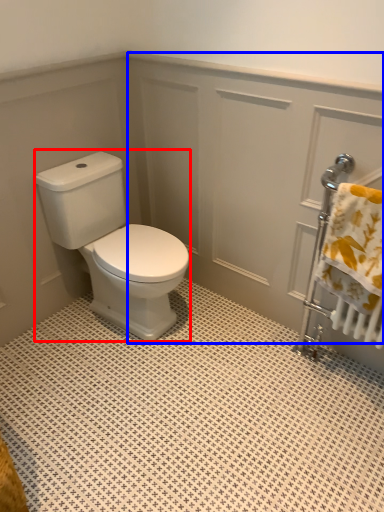
Question: Which object appears farthest to the camera in this image, porcelain (highlighted by a red box) or screen door (highlighted by a blue box)?

Choices:
 (A) porcelain
 (B) screen door

Answer: (A)